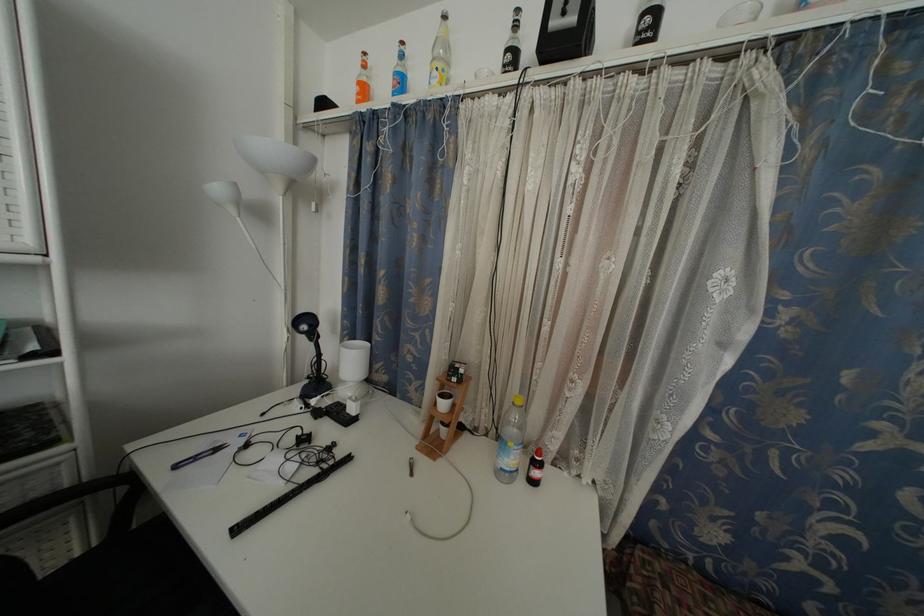
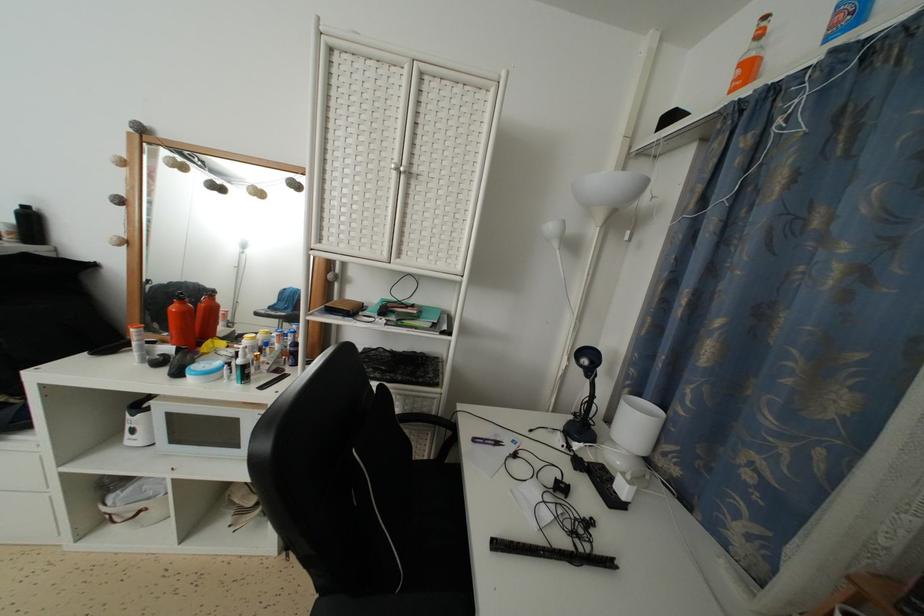
In the second image, find the point that corresponds to point 315,350 in the first image.

(591, 387)